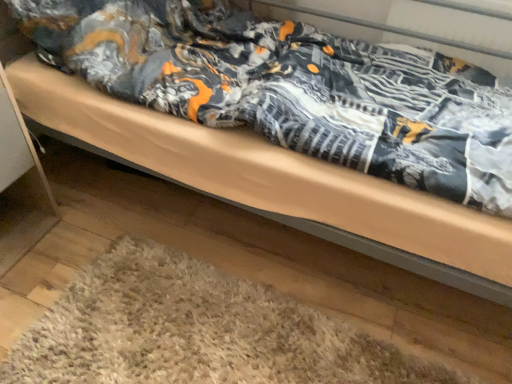
Describe the element at coordinates (197, 331) in the screenshot. I see `beige shaggy rug at lower center` at that location.

This screenshot has width=512, height=384. I want to click on beige shaggy rug at lower center, so click(197, 331).

Locate an element on the screen. This screenshot has width=512, height=384. beige shaggy rug at lower center is located at coordinates (197, 331).